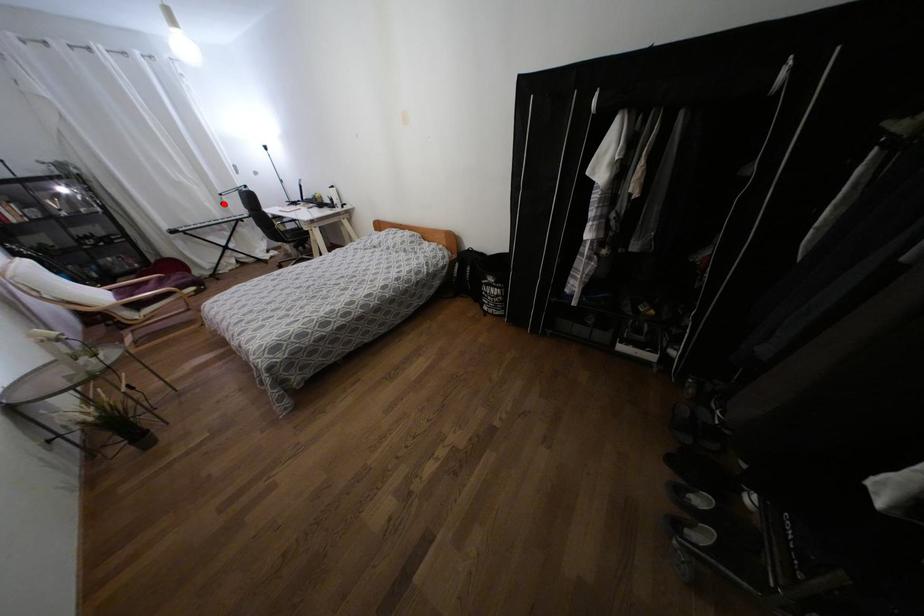
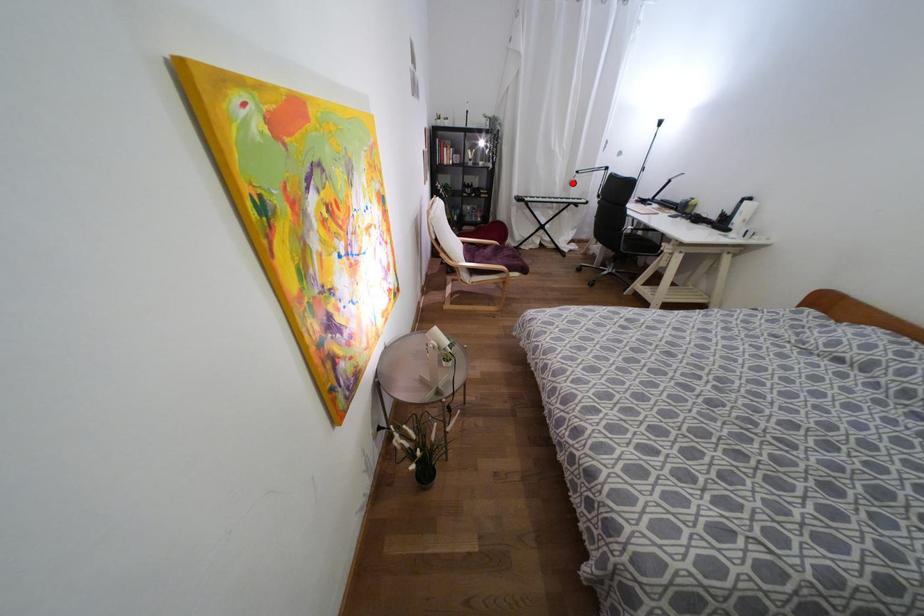
I am providing you with two images of the same scene from different viewpoints. A red point is marked on the first image and another point is marked on the second image. Is the red point in image1 aligned with the point shown in image2?

Yes